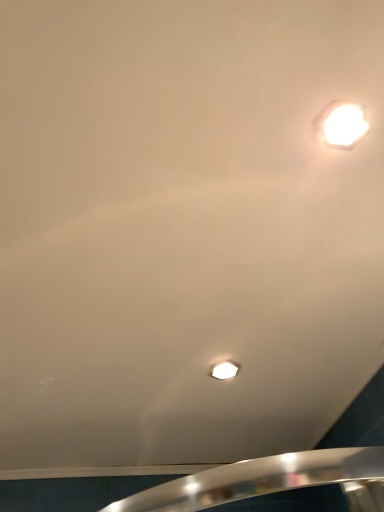
The image size is (384, 512). What do you see at coordinates (340, 125) in the screenshot?
I see `white hexagonal light fixture at upper right` at bounding box center [340, 125].

You are a GUI agent. You are given a task and a screenshot of the screen. Output one action in this format:
    pyautogui.click(x=<x>, y=<y>)
    Task: Click on the white hexagonal light fixture at upper right
    Image resolution: width=384 pixels, height=512 pixels.
    Given the screenshot: What is the action you would take?
    pyautogui.click(x=340, y=125)

Where is `white hexagonal light fixture at upper right`? This screenshot has height=512, width=384. white hexagonal light fixture at upper right is located at coordinates (340, 125).